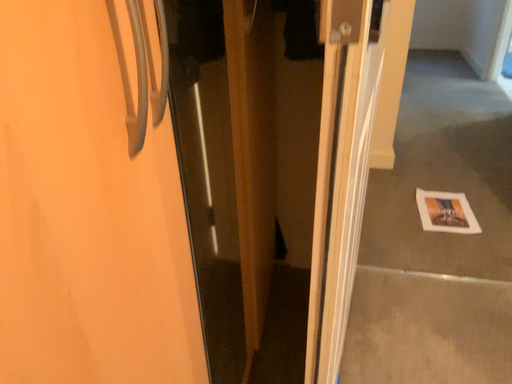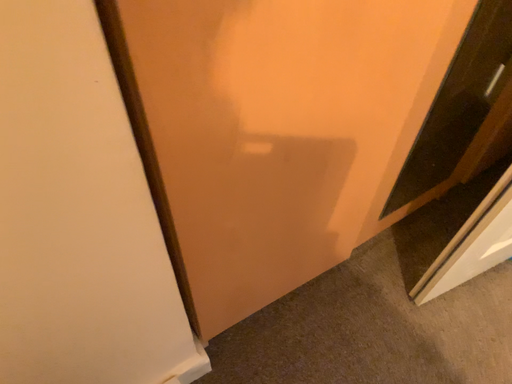
Question: Which way did the camera rotate in the video?

Choices:
 (A) rotated downward
 (B) rotated upward

Answer: (A)